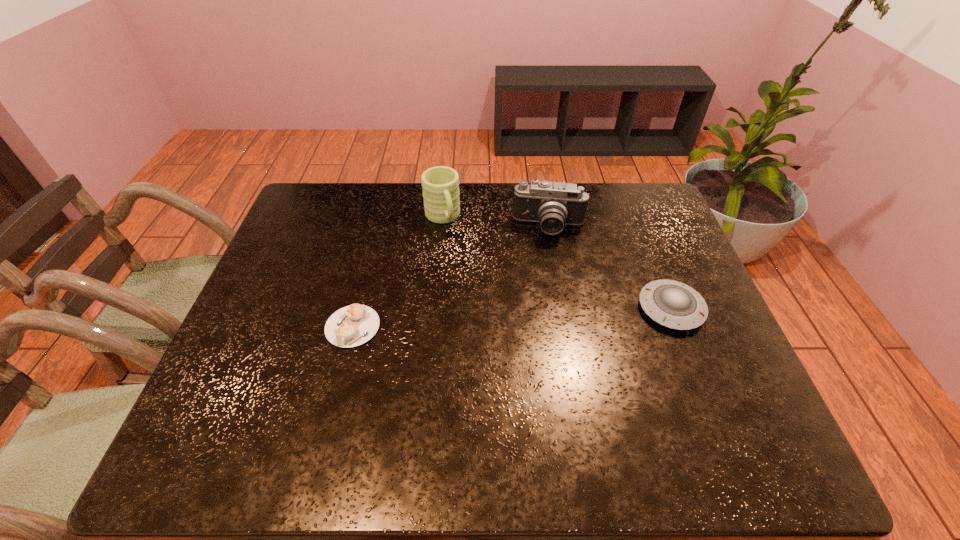
At what (x,y) coordinates should I click in order to perform the action: click on the leftmost object. Please return your answer as a coordinate pair (x, y). This screenshot has width=960, height=540. Looking at the image, I should click on (351, 326).

At what (x,y) coordinates should I click in order to perform the action: click on cappuccino. Please return your answer as a coordinate pair (x, y). The image size is (960, 540). Looking at the image, I should click on (351, 326).

The height and width of the screenshot is (540, 960). Find the location of `the rightmost object`. the rightmost object is located at coordinates click(x=673, y=304).

Find the location of a particular element. This screenshot has height=540, width=960. saucer is located at coordinates (673, 304).

Locate an element on the screen. mug is located at coordinates (440, 184).

Image resolution: width=960 pixels, height=540 pixels. Identify the location of the third object from left to right. (553, 204).

This screenshot has width=960, height=540. I want to click on vacant space positioned 0.060m on the front of the cappuccino, so pos(342,370).

The height and width of the screenshot is (540, 960). I want to click on vacant space located 0.350m on the left of the rightmost object, so click(503, 308).

Find the location of `free spot located 0.350m on the side of the mug with the handle`. free spot located 0.350m on the side of the mug with the handle is located at coordinates (485, 318).

Find the location of a particular element. This screenshot has height=540, width=960. free space located on the side of the mug with the handle is located at coordinates (489, 327).